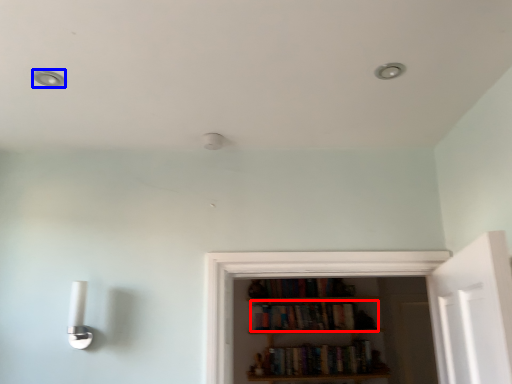
Question: Which point is further to the camera, book (highlighted by a red box) or dot (highlighted by a blue box)?

Choices:
 (A) book
 (B) dot

Answer: (A)